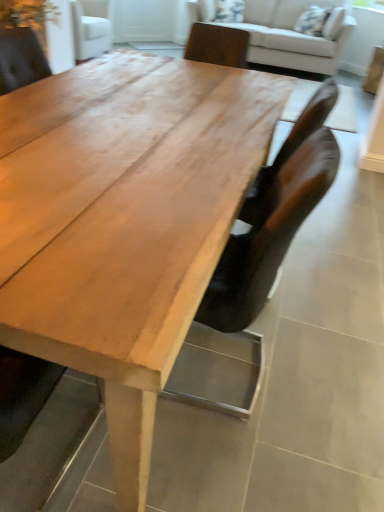
Question: Can you confirm if light brown wood table at center is taller than light beige fabric couch at upper center?

Choices:
 (A) yes
 (B) no

Answer: (B)

Question: Considering the relative sizes of light brown wood table at center and light beige fabric couch at upper center in the image provided, is light brown wood table at center bigger than light beige fabric couch at upper center?

Choices:
 (A) no
 (B) yes

Answer: (A)

Question: Is light brown wood table at center next to light beige fabric couch at upper center?

Choices:
 (A) yes
 (B) no

Answer: (B)

Question: Considering the relative sizes of light brown wood table at center and light beige fabric couch at upper center in the image provided, is light brown wood table at center thinner than light beige fabric couch at upper center?

Choices:
 (A) no
 (B) yes

Answer: (A)

Question: Would you say light brown wood table at center contains light beige fabric couch at upper center?

Choices:
 (A) no
 (B) yes

Answer: (A)

Question: Based on their sizes in the image, would you say light beige fabric couch at upper center is bigger or smaller than light brown wood table at center?

Choices:
 (A) big
 (B) small

Answer: (A)

Question: Does point (251, 33) appear closer or farther from the camera than point (190, 266)?

Choices:
 (A) closer
 (B) farther

Answer: (B)

Question: Considering the relative positions of light beige fabric couch at upper center and light brown wood table at center in the image provided, is light beige fabric couch at upper center to the left or to the right of light brown wood table at center?

Choices:
 (A) right
 (B) left

Answer: (A)

Question: From a real-world perspective, relative to light brown wood table at center, is light beige fabric couch at upper center vertically above or below?

Choices:
 (A) below
 (B) above

Answer: (B)

Question: From a real-world perspective, is brown leather chair at center above or below light beige fabric couch at upper center?

Choices:
 (A) below
 (B) above

Answer: (A)

Question: Does point pos(281,228) appear closer or farther from the camera than point pos(251,31)?

Choices:
 (A) closer
 (B) farther

Answer: (A)

Question: Is brown leather chair at center wider or thinner than light beige fabric couch at upper center?

Choices:
 (A) thin
 (B) wide

Answer: (A)

Question: From the image's perspective, is brown leather chair at center located above or below light beige fabric couch at upper center?

Choices:
 (A) below
 (B) above

Answer: (A)

Question: Considering the positions of light beige fabric couch at upper center and brown leather chair at center in the image, is light beige fabric couch at upper center bigger or smaller than brown leather chair at center?

Choices:
 (A) small
 (B) big

Answer: (B)

Question: Considering their positions, is light beige fabric couch at upper center located in front of or behind brown leather chair at center?

Choices:
 (A) behind
 (B) front

Answer: (A)